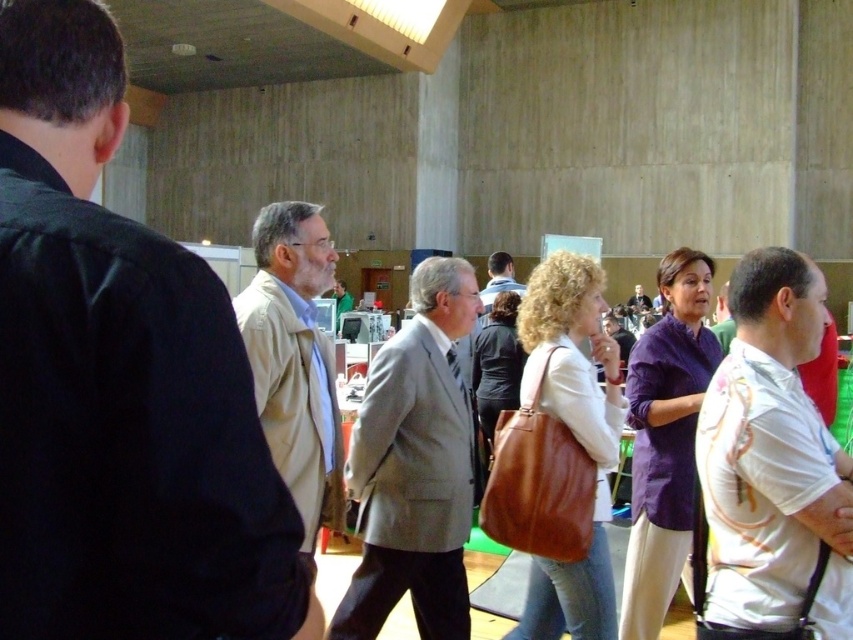
You are standing at point (772, 467) in the image. What is the object located exactly at this point?

The object at point (772, 467) is a white printed shirt at center.

You are standing at point (396, 493) and want to walk to point (807, 612). Is the destination point in front of you or behind you?

The destination point (807, 612) is in front of point (396, 493), so the destination is in front of you.

You are a photographer at the event and want to capture a candid shot of both the light gray suit at center and beige fabric jacket at center in the same frame. The camera you are using has a lens that can focus on objects within a 20 inch range. Will you be able to capture both subjects in focus without moving the camera?

The light gray suit at center and beige fabric jacket at center are 23.12 inches apart. Since the distance between them exceeds the camera lens focus range of 20 inches, you will not be able to capture both subjects in focus without adjusting the camera settings or moving closer.